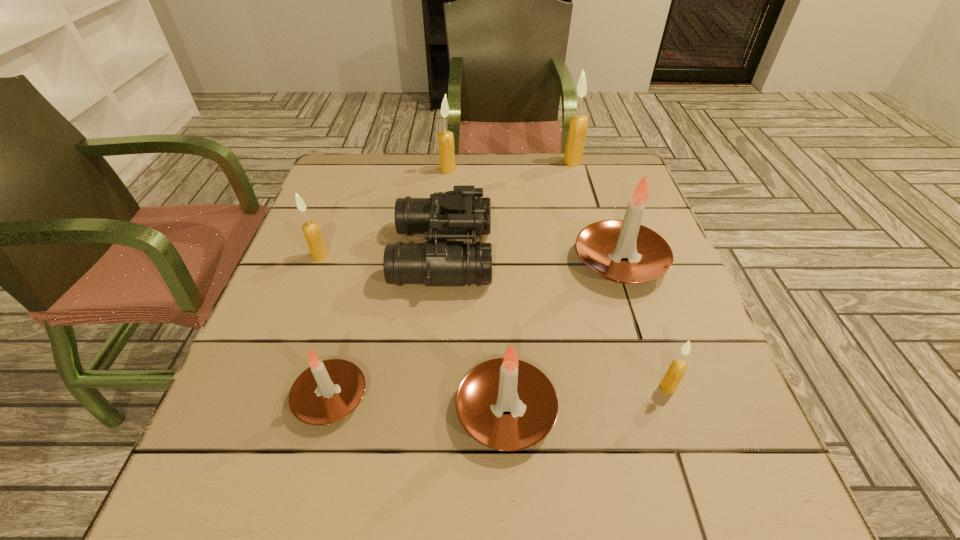
I want to click on free space located through the lenses of the blue binoculars, so click(643, 254).

The width and height of the screenshot is (960, 540). I want to click on vacant position located on the right of the smallest white candle, so click(x=455, y=397).

Where is `vacant space located on the left of the rightmost cream candle`? vacant space located on the left of the rightmost cream candle is located at coordinates (563, 387).

The width and height of the screenshot is (960, 540). In order to click on object that is at the near edge in this screenshot , I will do `click(504, 384)`.

Locate an element on the screen. object that is at the far right corner is located at coordinates (578, 124).

Where is `vacant space at the far edge of the desktop`? This screenshot has width=960, height=540. vacant space at the far edge of the desktop is located at coordinates (390, 190).

Find the location of a particular element. free region at the near edge of the desktop is located at coordinates (552, 505).

The image size is (960, 540). In the image, there is a desktop. In order to click on vacant space at the left edge in this screenshot , I will do `click(330, 239)`.

Identify the location of free location at the right edge of the desktop. This screenshot has width=960, height=540. (686, 329).

This screenshot has height=540, width=960. Identify the location of free point at the far left corner. (359, 168).